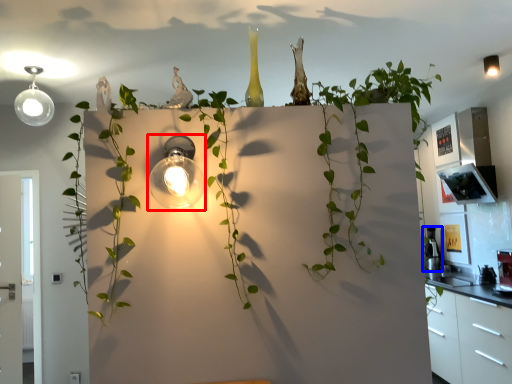
Question: Among these objects, which one is nearest to the camera, light fixture (highlighted by a red box) or appliance (highlighted by a blue box)?

Choices:
 (A) light fixture
 (B) appliance

Answer: (A)